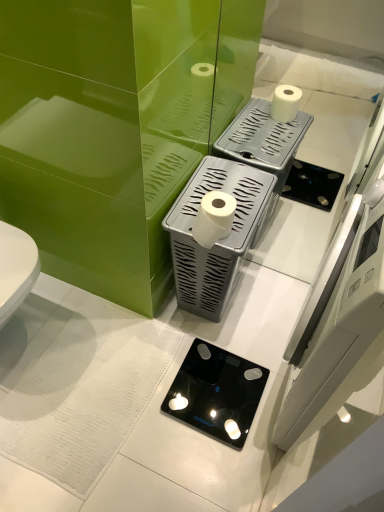
Identify the location of vacant space in front of black glass scale at center, the second appliance when ordered from top to bottom. (206, 466).